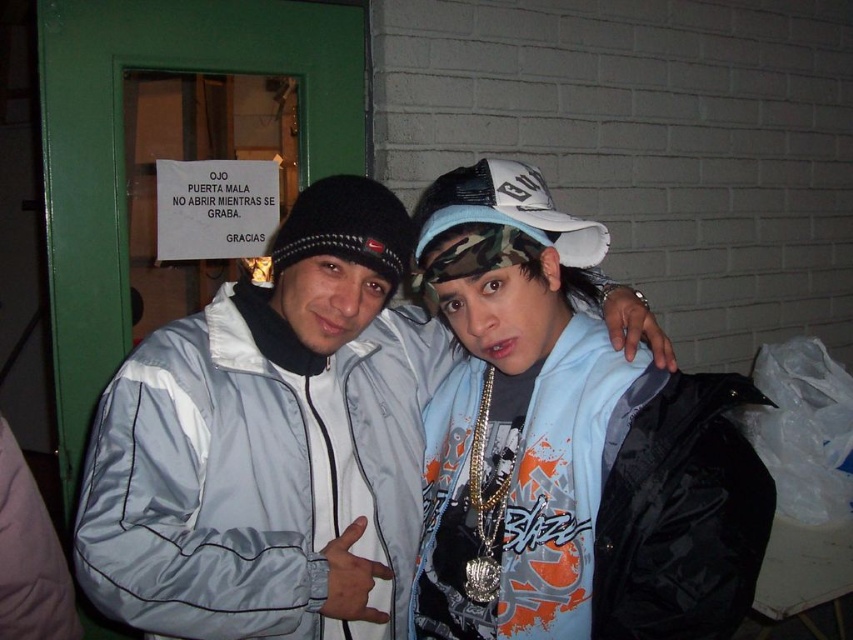
You are a photographer trying to adjust the lighting for a photo shoot. You notice the light blue fabric shirt at center and the camo fabric baseball cap at upper center. Which object is located higher in the image?

The camo fabric baseball cap at upper center is higher in the image than the light blue fabric shirt at center.

Based on the photo, you are a photographer trying to capture a clear shot of both the light gray jacket at center and the camo fabric baseball cap at upper center. Considering their sizes in the frame, which object should you focus on first to ensure it is in sharp focus?

The light gray jacket at center is much taller than the camo fabric baseball cap at upper center, so you should focus on the light gray jacket at center first to ensure it is in sharp focus.

You are trying to fit through a narrow doorway that is only wide enough for one person at a time. You see the light gray jacket at center and the light blue fabric shirt at center in the scene. Which clothing item would you choose to wear if you want to pass through the doorway more easily?

The light blue fabric shirt at center would allow you to pass through the doorway more easily since it is narrower than the light gray jacket at center.